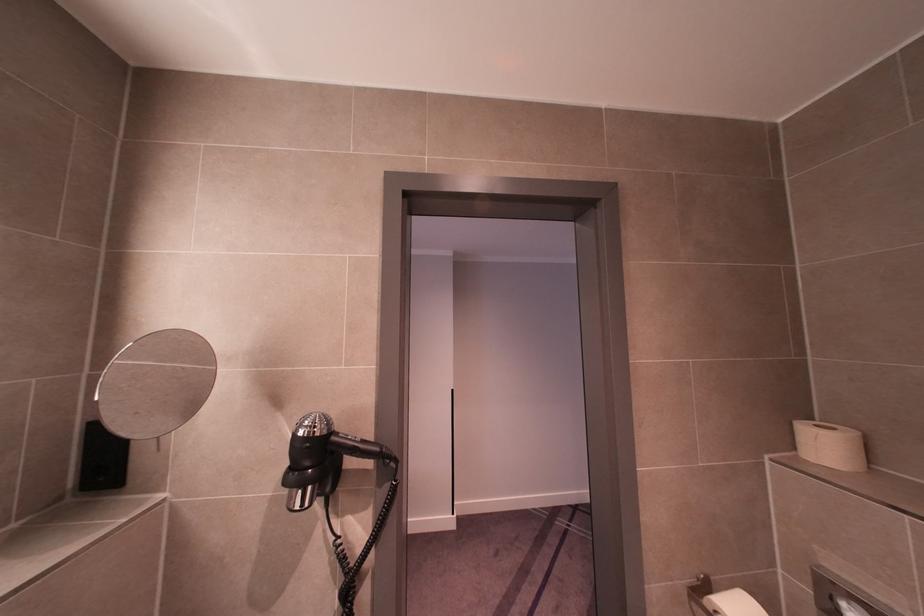
Locate an element on the screen. hair-dryer handle is located at coordinates (360, 448).